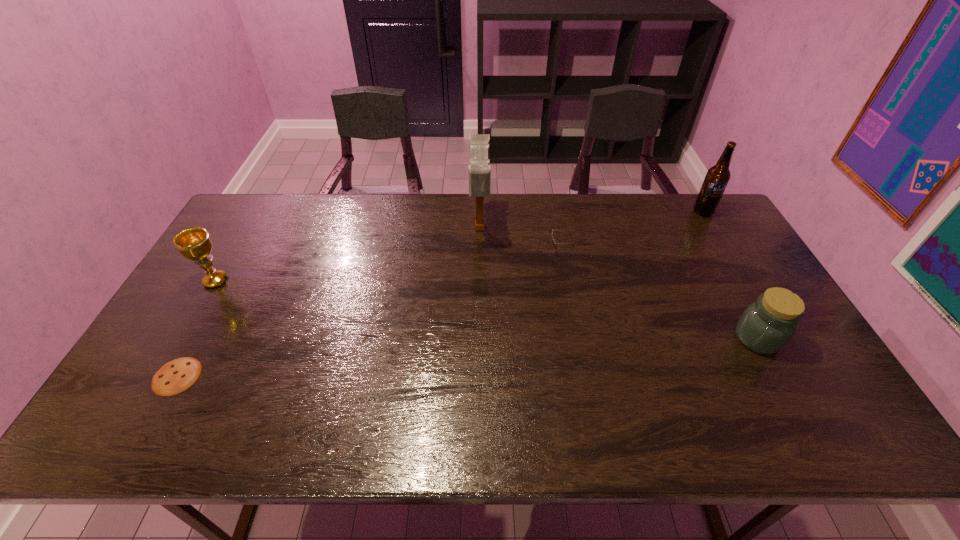
The height and width of the screenshot is (540, 960). What are the coordinates of `empty location between the sunglasses and the chalice` in the screenshot? It's located at coord(388,266).

Where is `vacant space that's between the second shortest object and the second nearest object`? The image size is (960, 540). vacant space that's between the second shortest object and the second nearest object is located at coordinates [x=659, y=294].

Identify the location of vacant space in between the beer bottle and the fourth farthest object. (459, 246).

Identify the location of unoccupied area between the chalice and the third object from left to right. (348, 254).

The image size is (960, 540). I want to click on vacant area between the third nearest object and the fourth object from left to right, so click(388, 266).

The height and width of the screenshot is (540, 960). I want to click on empty space between the jar and the mallet, so click(x=618, y=283).

At what (x,y) coordinates should I click in order to perform the action: click on free space between the shortest object and the third object from left to right. Please return your answer as a coordinate pair (x, y). The height and width of the screenshot is (540, 960). Looking at the image, I should click on (328, 302).

Where is `free space between the cookie and the mallet`? This screenshot has width=960, height=540. free space between the cookie and the mallet is located at coordinates (328, 302).

Find the location of a particular element. This screenshot has width=960, height=540. the second closest object to the shortest object is located at coordinates (479, 169).

Find the location of a particular element. This screenshot has width=960, height=540. object that is the fourth closest one to the beer bottle is located at coordinates (194, 243).